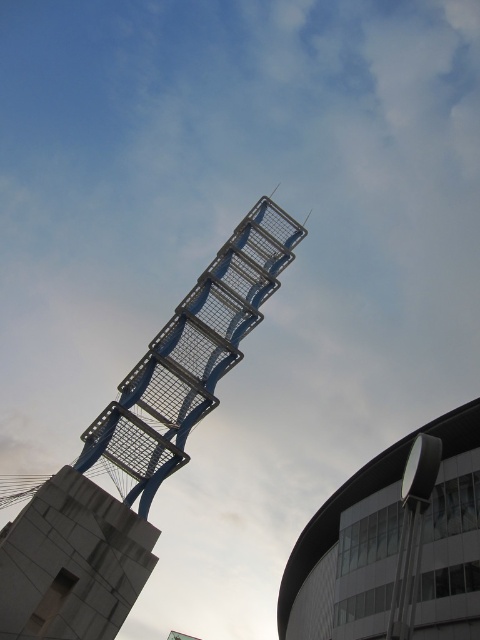
You are an architect analyzing the image. You need to determine which of the two towers, the metallic grid tower at center or the metallic silver tower at upper center, would cast a longer shadow during midday. Based on their sizes and positions, which one do you think it would be?

The metallic grid tower at center has a larger size compared to the metallic silver tower at upper center, so it would cast a longer shadow during midday.

You are standing in front of the architectural complex and want to take a photo that includes both the metallic grid tower at center and the metallic silver tower at upper center. Which tower should you position lower in your camera frame to ensure both are visible?

The metallic grid tower at center is located above the metallic silver tower at upper center, so to include both in the frame, position the metallic grid tower at center lower in the camera frame.

You are standing at the point marked as point (190, 358) in the image. What object are you directly facing?

The metallic grid tower at center is located at point (190, 358), so you are directly facing the metallic grid tower at center.